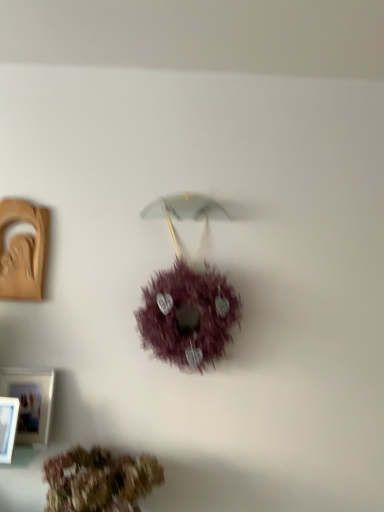
Question: Is purple fluffy wreath at center, the second flower ordered from the bottom, far from matte brown picture frame at left, the 3th picture frame when ordered from front to back?

Choices:
 (A) yes
 (B) no

Answer: (B)

Question: Is purple fluffy wreath at center, which is counted as the 1th flower, starting from the top, smaller than matte brown picture frame at left, the 1th picture frame positioned from the top?

Choices:
 (A) no
 (B) yes

Answer: (A)

Question: Can you confirm if purple fluffy wreath at center, which is counted as the 1th flower, starting from the top, is wider than matte brown picture frame at left, the 3th picture frame when ordered from front to back?

Choices:
 (A) no
 (B) yes

Answer: (B)

Question: Would you say purple fluffy wreath at center, which is counted as the 1th flower, starting from the top, contains matte brown picture frame at left, which is counted as the 3th picture frame, starting from the bottom?

Choices:
 (A) no
 (B) yes

Answer: (A)

Question: From the image's perspective, does purple fluffy wreath at center, which is counted as the 1th flower, starting from the top, appear higher than matte brown picture frame at left, which is counted as the 3th picture frame, starting from the bottom?

Choices:
 (A) no
 (B) yes

Answer: (A)

Question: From the image's perspective, is matte brown picture frame at left, the 3th picture frame when ordered from front to back, positioned above or below white plastic picture frame at lower left, the first picture frame when ordered from bottom to top?

Choices:
 (A) above
 (B) below

Answer: (A)

Question: From a real-world perspective, is matte brown picture frame at left, the 1th picture frame in the back-to-front sequence, positioned above or below white plastic picture frame at lower left, the first picture frame when ordered from bottom to top?

Choices:
 (A) above
 (B) below

Answer: (A)

Question: Considering the positions of matte brown picture frame at left, the 1th picture frame in the back-to-front sequence, and white plastic picture frame at lower left, which is the third picture frame from back to front, in the image, is matte brown picture frame at left, the 1th picture frame in the back-to-front sequence, wider or thinner than white plastic picture frame at lower left, which is the third picture frame from back to front,?

Choices:
 (A) thin
 (B) wide

Answer: (A)

Question: Is matte brown picture frame at left, which is counted as the 3th picture frame, starting from the bottom, taller or shorter than white plastic picture frame at lower left, the first picture frame when ordered from bottom to top?

Choices:
 (A) tall
 (B) short

Answer: (A)

Question: From a real-world perspective, is white plastic picture frame at lower left, marked as the 3th picture frame in a top-to-bottom arrangement, above or below matte brown picture frame at left, the 3th picture frame when ordered from front to back?

Choices:
 (A) below
 (B) above

Answer: (A)

Question: From the image's perspective, relative to matte brown picture frame at left, which is counted as the 3th picture frame, starting from the bottom, is white plastic picture frame at lower left, which ranks as the 1th picture frame in front-to-back order, above or below?

Choices:
 (A) above
 (B) below

Answer: (B)

Question: Would you say white plastic picture frame at lower left, marked as the 3th picture frame in a top-to-bottom arrangement, is to the left or to the right of matte brown picture frame at left, the 3th picture frame when ordered from front to back, in the picture?

Choices:
 (A) left
 (B) right

Answer: (B)

Question: Based on their sizes in the image, would you say white plastic picture frame at lower left, marked as the 3th picture frame in a top-to-bottom arrangement, is bigger or smaller than matte brown picture frame at left, the 3th picture frame when ordered from front to back?

Choices:
 (A) small
 (B) big

Answer: (A)

Question: From the image's perspective, is white plastic picture frame at lower left, marked as the 3th picture frame in a top-to-bottom arrangement, positioned above or below white matte picture frame at lower left, arranged as the 2th picture frame when ordered from the bottom?

Choices:
 (A) above
 (B) below

Answer: (B)

Question: Considering the positions of point (6, 459) and point (21, 424), is point (6, 459) closer or farther from the camera than point (21, 424)?

Choices:
 (A) closer
 (B) farther

Answer: (B)